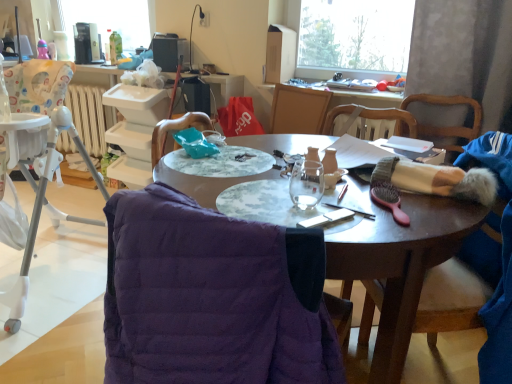
Question: From a real-world perspective, is white plastic highchair at left physically located above or below matte purple jacket at lower left?

Choices:
 (A) above
 (B) below

Answer: (A)

Question: Would you say white plastic highchair at left is to the left or to the right of matte purple jacket at lower left in the picture?

Choices:
 (A) left
 (B) right

Answer: (A)

Question: Which of these objects is positioned closest to the green plastic bottle at upper left?

Choices:
 (A) black plastic pen at center
 (B) metallic black lamp at upper center
 (C) purple quilted jacket at center, which is the 2th chair from right to left
 (D) white plastic radiator at left
 (E) white plastic highchair at left

Answer: (D)

Question: Which is nearer to the white plastic radiator at left?

Choices:
 (A) purple quilted jacket at center, which is the 2th chair from right to left
 (B) green plastic bottle at upper left
 (C) white plastic highchair at left
 (D) white plastic power outlet at upper center
 (E) black plastic pen at center

Answer: (B)